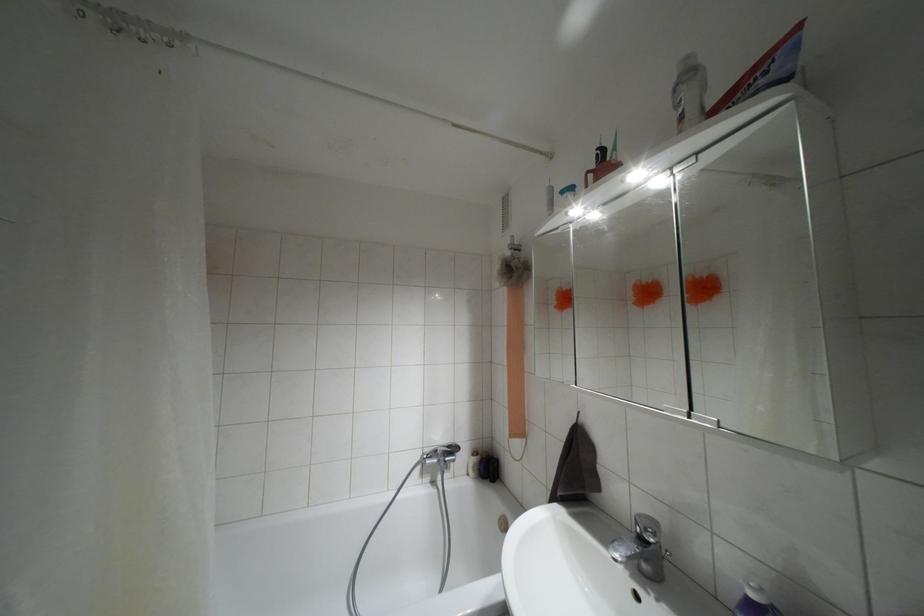
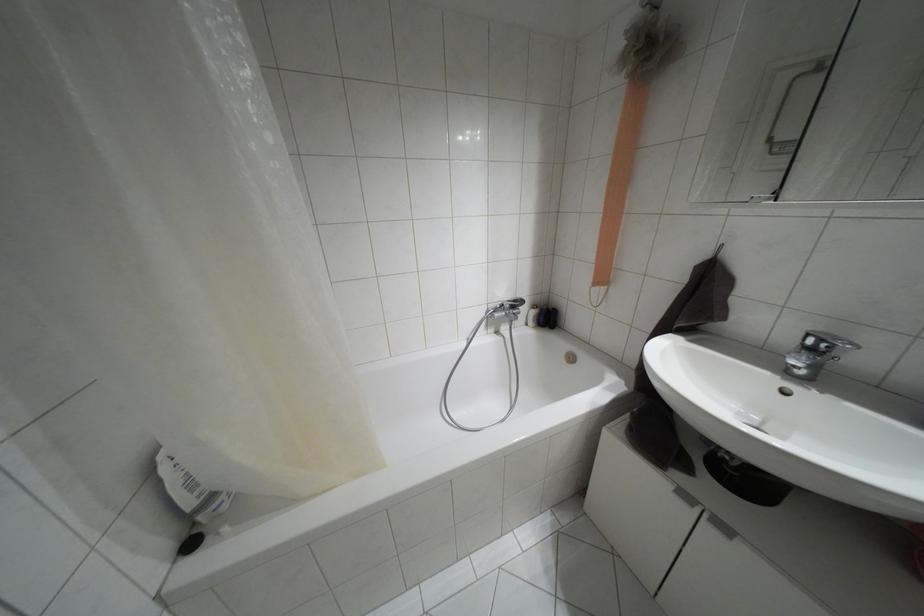
The point at (489, 467) is marked in the first image. Where is the corresponding point in the second image?

(546, 317)